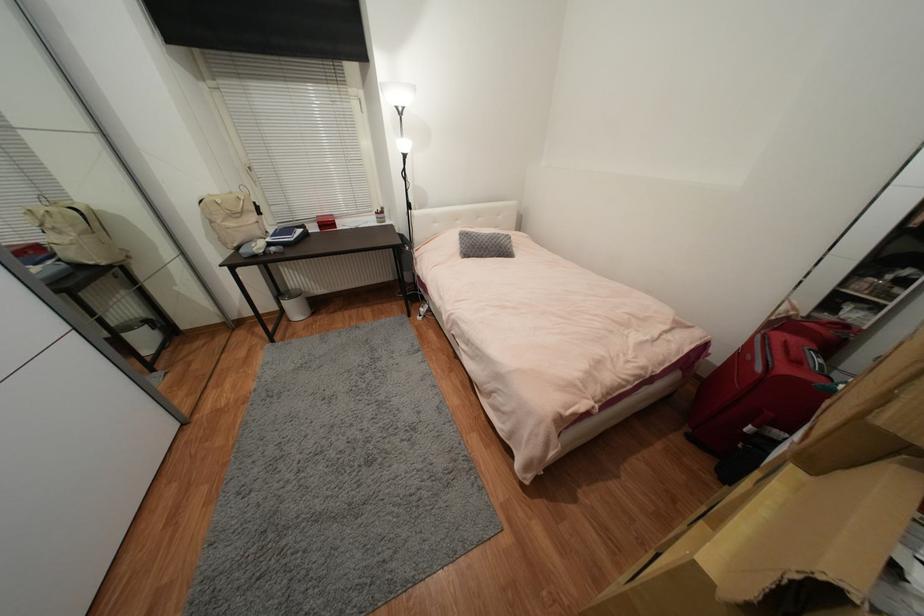
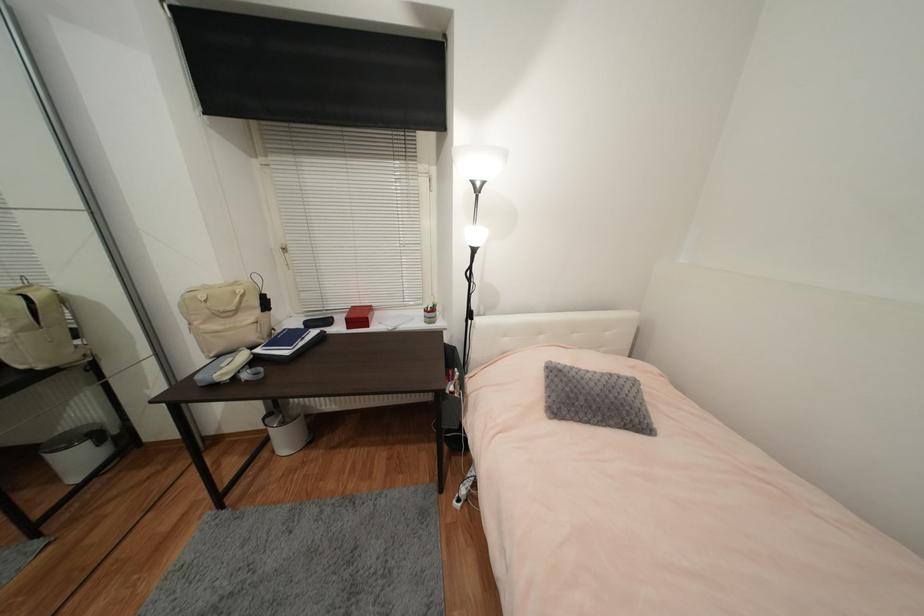
Find the pixel in the second image that matches point 490,241 in the first image.

(602, 391)